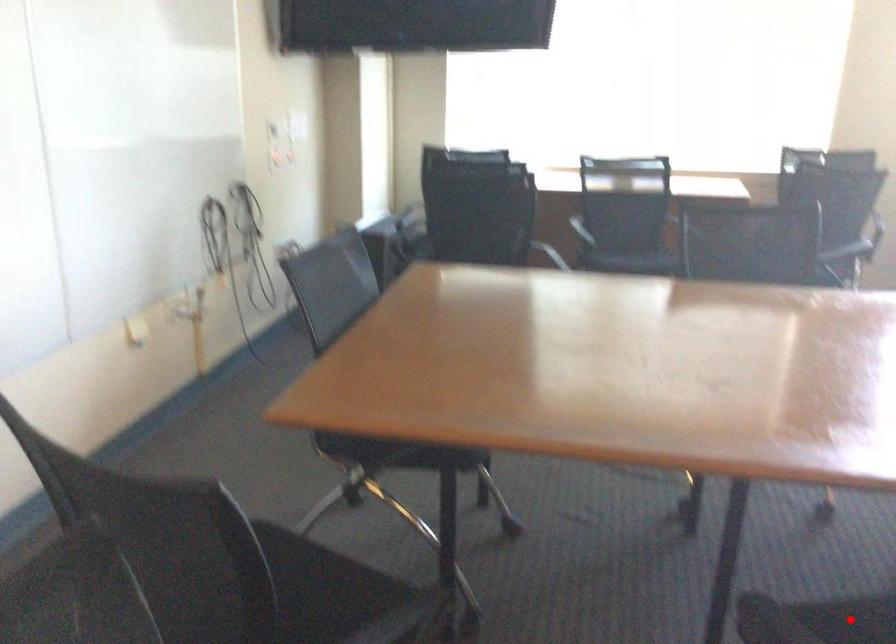
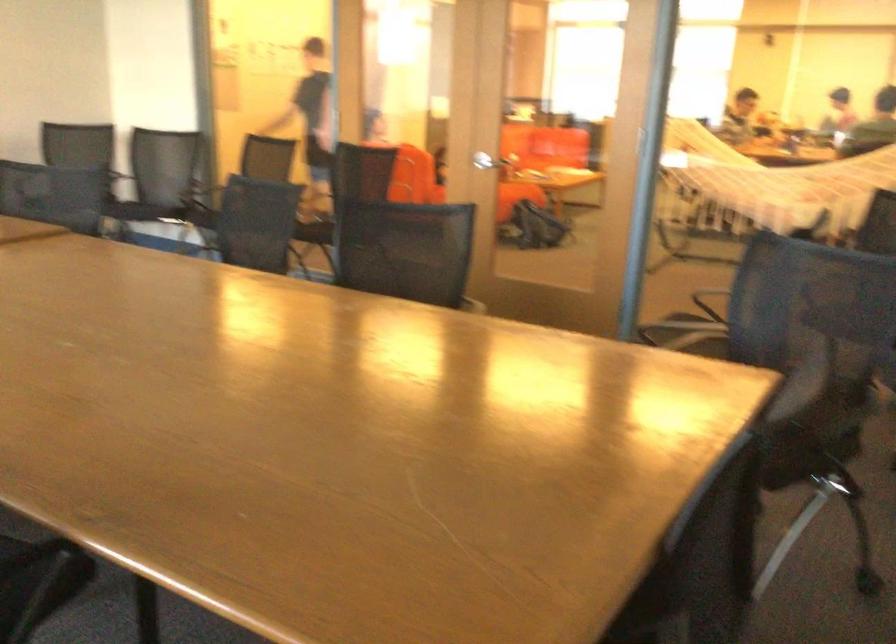
Question: I am providing you with two images of the same scene from different viewpoints. A red point is marked on the first image. Is the red point's position out of view in image 2?

Choices:
 (A) Yes
 (B) No

Answer: (A)